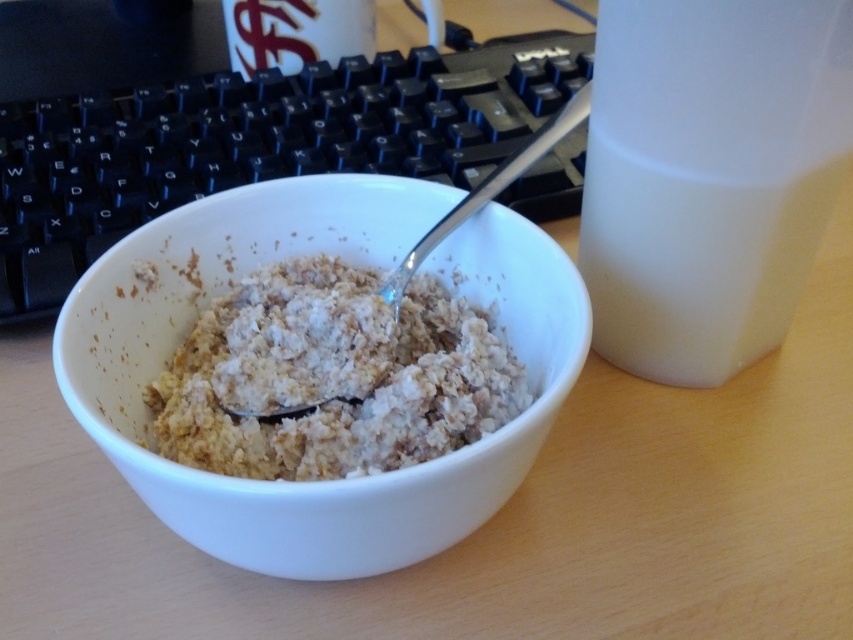
Is white textured cereal at center thinner than silver metallic spoon at center?

Yes, white textured cereal at center is thinner than silver metallic spoon at center.

What do you see at coordinates (332, 376) in the screenshot? I see `white textured cereal at center` at bounding box center [332, 376].

Find the location of a particular element. This screenshot has width=853, height=640. white textured cereal at center is located at coordinates (332, 376).

Who is lower down, white matte bowl at center or silver metallic spoon at center?

white matte bowl at center is lower down.

Which is in front, point (471, 230) or point (566, 131)?

Point (471, 230) is more forward.

Measure the distance between white matte bowl at center and camera.

The distance of white matte bowl at center from camera is 18.20 inches.

Where is `white matte bowl at center`? This screenshot has width=853, height=640. white matte bowl at center is located at coordinates (350, 260).

Which is below, white matte bowl at center or white opaque jug at right?

white matte bowl at center is below.

In the scene shown: Who is shorter, white matte bowl at center or white opaque jug at right?

white opaque jug at right is shorter.

Between point (541, 323) and point (730, 230), which one is positioned behind?

Positioned behind is point (541, 323).

Where is `white matte bowl at center`? The height and width of the screenshot is (640, 853). white matte bowl at center is located at coordinates (350, 260).